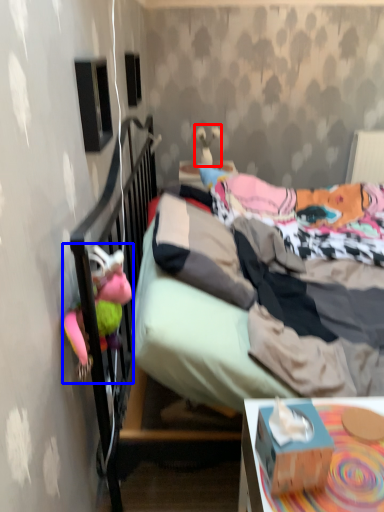
Question: Among these objects, which one is nearest to the camera, toy (highlighted by a red box) or toy (highlighted by a blue box)?

Choices:
 (A) toy
 (B) toy

Answer: (B)